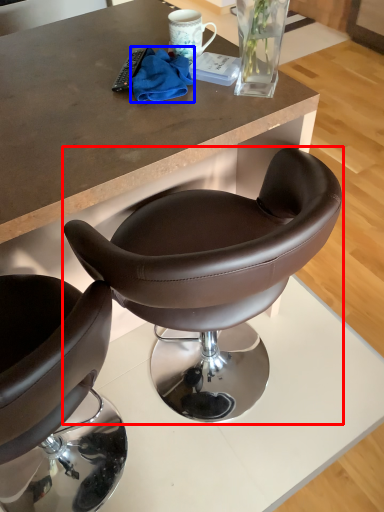
Question: Which of the following is the farthest to the observer, chair (highlighted by a red box) or material (highlighted by a blue box)?

Choices:
 (A) chair
 (B) material

Answer: (B)